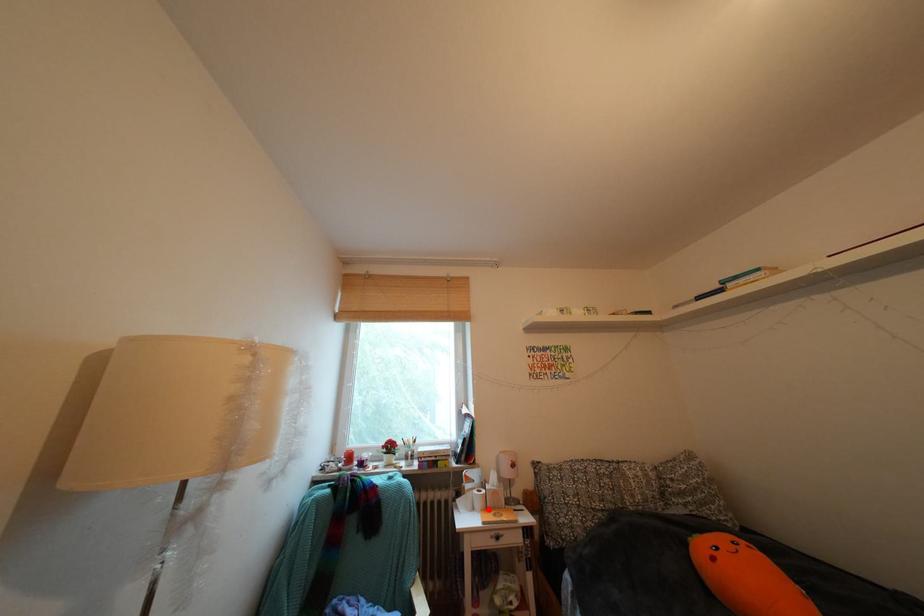
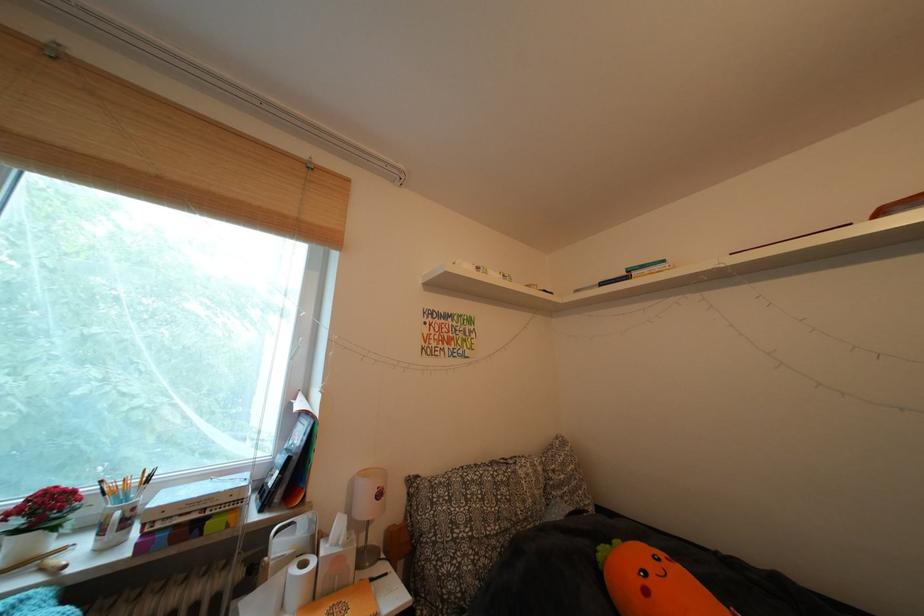
In the second image, find the point that corresponds to the highlighted location in the first image.

(306, 602)